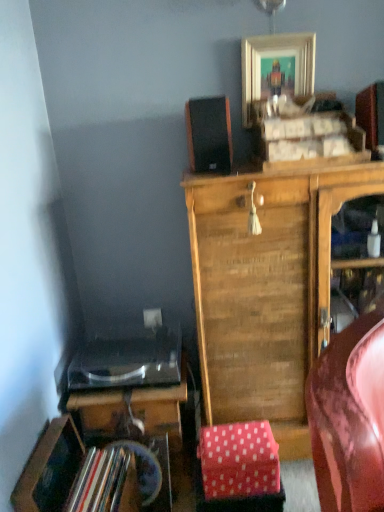
Question: From a real-world perspective, is black matte speaker at upper center physically below pink polka dot fabric at lower center?

Choices:
 (A) no
 (B) yes

Answer: (A)

Question: Can you confirm if black matte speaker at upper center is smaller than pink polka dot fabric at lower center?

Choices:
 (A) yes
 (B) no

Answer: (B)

Question: Would you say black matte speaker at upper center is a long distance from pink polka dot fabric at lower center?

Choices:
 (A) no
 (B) yes

Answer: (B)

Question: Can you confirm if black matte speaker at upper center is shorter than pink polka dot fabric at lower center?

Choices:
 (A) no
 (B) yes

Answer: (A)

Question: From the image's perspective, is black matte speaker at upper center below pink polka dot fabric at lower center?

Choices:
 (A) no
 (B) yes

Answer: (A)

Question: Visually, is shiny black desk at lower left positioned to the left or to the right of pink polka dot fabric at lower center?

Choices:
 (A) left
 (B) right

Answer: (A)

Question: From a real-world perspective, is shiny black desk at lower left physically located above or below pink polka dot fabric at lower center?

Choices:
 (A) below
 (B) above

Answer: (B)

Question: Is shiny black desk at lower left wider or thinner than pink polka dot fabric at lower center?

Choices:
 (A) wide
 (B) thin

Answer: (A)

Question: In terms of size, does shiny black desk at lower left appear bigger or smaller than pink polka dot fabric at lower center?

Choices:
 (A) small
 (B) big

Answer: (B)

Question: Considering the positions of point (192, 136) and point (306, 33), is point (192, 136) closer or farther from the camera than point (306, 33)?

Choices:
 (A) closer
 (B) farther

Answer: (A)

Question: Is black matte speaker at upper center inside or outside of gold metallic picture frame at upper center?

Choices:
 (A) inside
 (B) outside

Answer: (B)

Question: In terms of size, does black matte speaker at upper center appear bigger or smaller than gold metallic picture frame at upper center?

Choices:
 (A) big
 (B) small

Answer: (A)

Question: From the image's perspective, is black matte speaker at upper center located above or below gold metallic picture frame at upper center?

Choices:
 (A) below
 (B) above

Answer: (A)

Question: From the image's perspective, is wooden cabinet at center positioned above or below pink polka dot fabric at lower center?

Choices:
 (A) below
 (B) above

Answer: (B)

Question: Considering the positions of wooden cabinet at center and pink polka dot fabric at lower center in the image, is wooden cabinet at center taller or shorter than pink polka dot fabric at lower center?

Choices:
 (A) tall
 (B) short

Answer: (A)